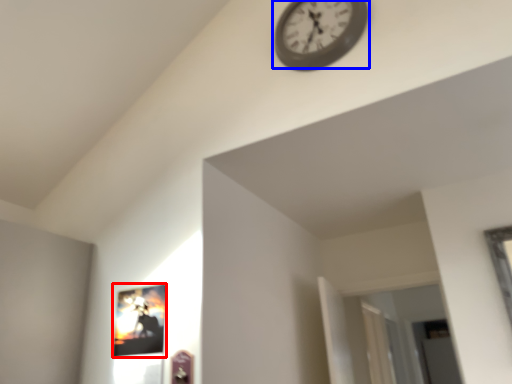
Question: Which of the following is the closest to the observer, picture frame (highlighted by a red box) or wall clock (highlighted by a blue box)?

Choices:
 (A) picture frame
 (B) wall clock

Answer: (A)